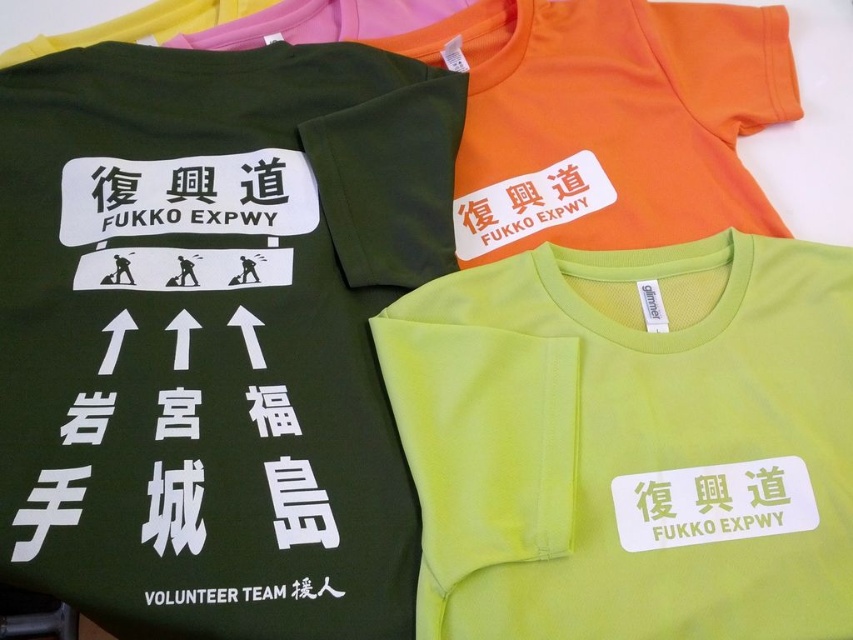
Question: Where is matte green t-shirt at center located in relation to lime green t-shirt at center in the image?

Choices:
 (A) above
 (B) below

Answer: (A)

Question: Which of the following is the closest to the observer?

Choices:
 (A) pyautogui.click(x=706, y=385)
 (B) pyautogui.click(x=329, y=125)

Answer: (A)

Question: Which point is closer to the camera taking this photo?

Choices:
 (A) (392, 224)
 (B) (426, 451)

Answer: (B)

Question: Does matte green t-shirt at center have a larger size compared to lime green t-shirt at center?

Choices:
 (A) no
 (B) yes

Answer: (B)

Question: Is matte green t-shirt at center wider than lime green t-shirt at center?

Choices:
 (A) no
 (B) yes

Answer: (B)